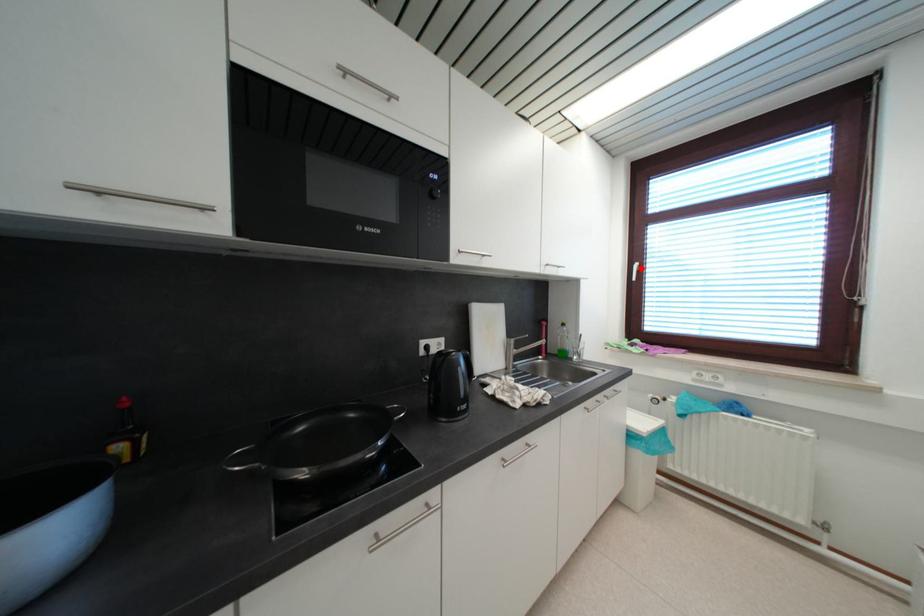
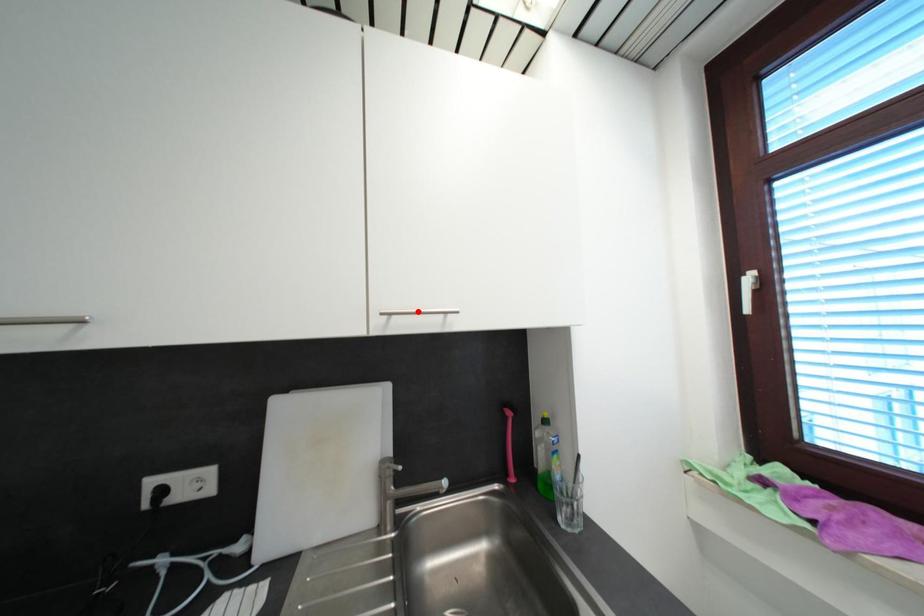
I am providing you with two images of the same scene from different viewpoints. A red point is marked on the first image and another point is marked on the second image. Are the points marked in image1 and image2 representing the same 3D position?

No